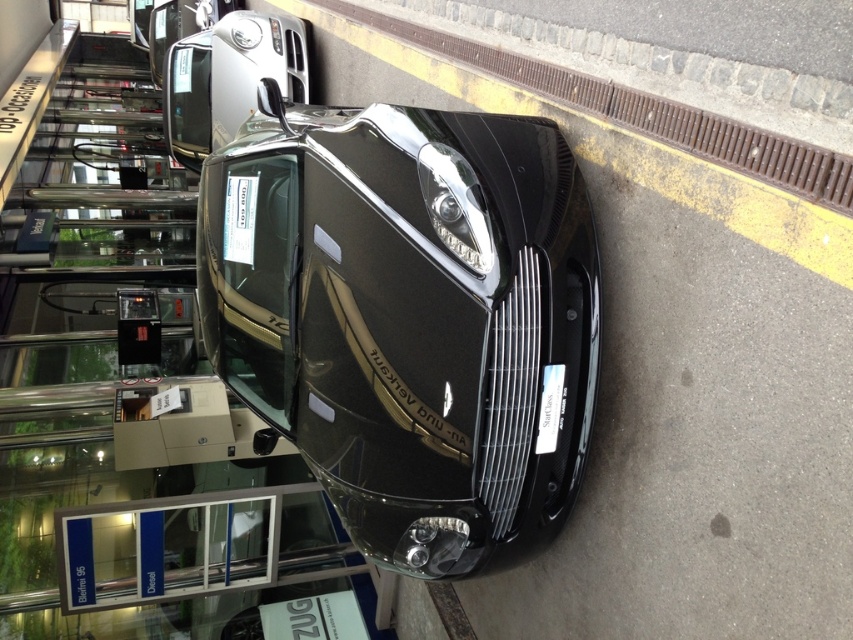
Question: Can you confirm if glossy black car at center is positioned to the left of satin silver car at upper center?

Choices:
 (A) yes
 (B) no

Answer: (B)

Question: Can you confirm if glossy black car at center is smaller than satin silver car at upper center?

Choices:
 (A) no
 (B) yes

Answer: (A)

Question: Is the position of glossy black car at center more distant than that of satin silver car at upper center?

Choices:
 (A) no
 (B) yes

Answer: (A)